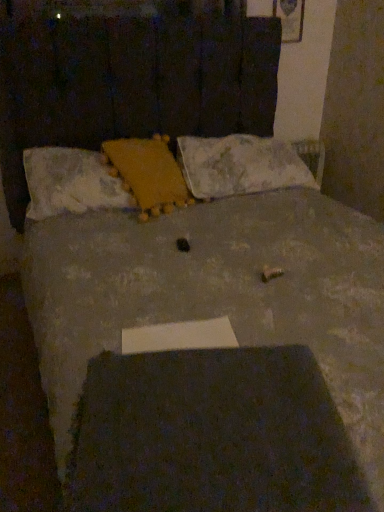
Question: Looking at the image, does yellow fuzzy pillow at upper center, placed as the 2th pillow when sorted from right to left, seem bigger or smaller compared to white soft pillow at center, the 1th pillow in the right-to-left sequence?

Choices:
 (A) small
 (B) big

Answer: (A)

Question: From their relative heights in the image, would you say yellow fuzzy pillow at upper center, placed as the 2th pillow when sorted from right to left, is taller or shorter than white soft pillow at center, the 1th pillow in the right-to-left sequence?

Choices:
 (A) short
 (B) tall

Answer: (B)

Question: Estimate the real-world distances between objects in this image. Which object is farther from the white soft pillow at center, the 1th pillow in the right-to-left sequence?

Choices:
 (A) yellow fuzzy pillow at upper center, acting as the second pillow starting from the left
 (B) fluffy white pillow at upper left, which is the first pillow in left-to-right order

Answer: (B)

Question: Which object is the closest to the white soft pillow at center, the 1th pillow in the right-to-left sequence?

Choices:
 (A) fluffy white pillow at upper left, placed as the third pillow when sorted from right to left
 (B) yellow fuzzy pillow at upper center, acting as the second pillow starting from the left

Answer: (B)